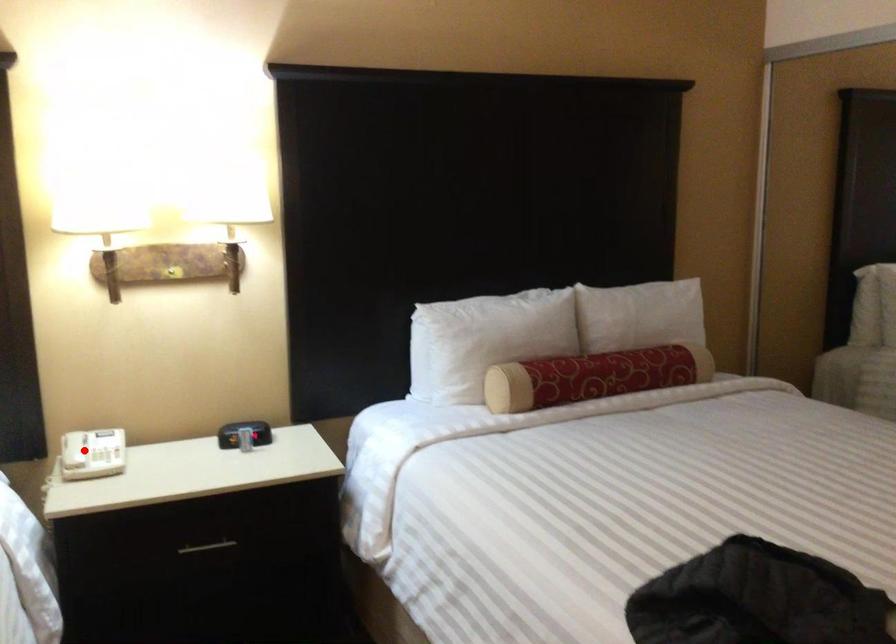
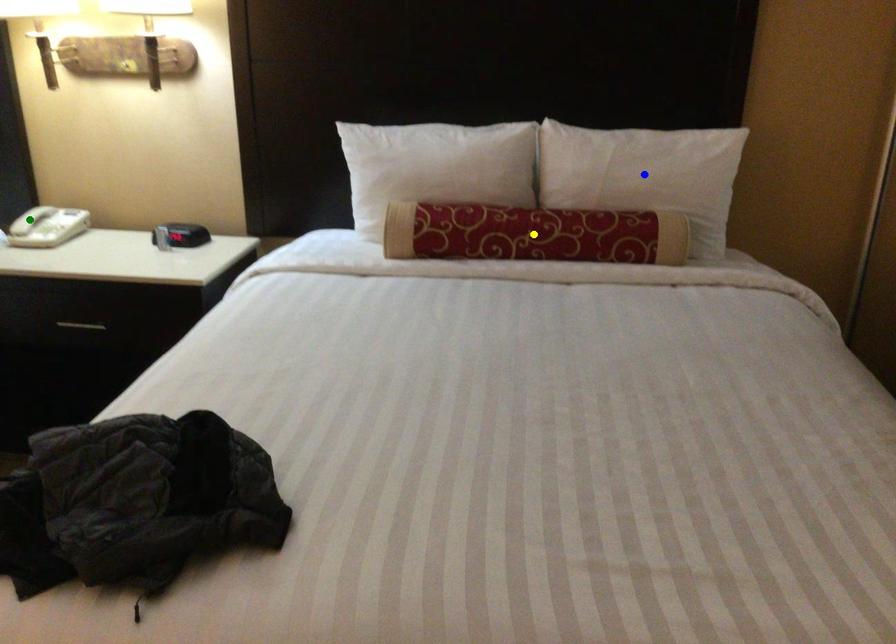
Question: I am providing you with two images of the same scene from different viewpoints. A red point is marked on the first image. You are given multiple points on the second image. Which spot in image 2 lines up with the point in image 1?

Choices:
 (A) yellow point
 (B) blue point
 (C) green point

Answer: (C)